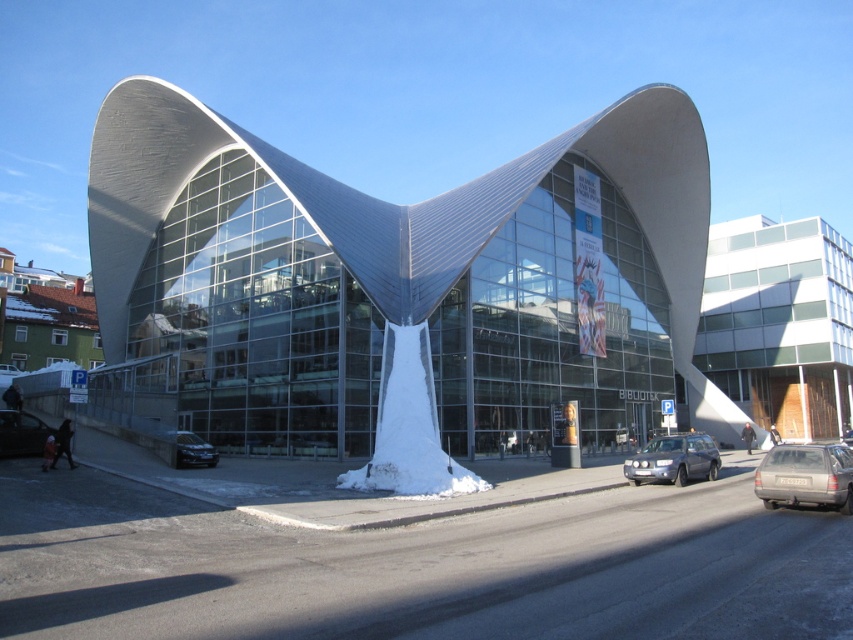
You are a delivery person arriving at the building and need to enter through the white wooden door at right. Is the satin black sedan at lower left blocking your path to the door?

The satin black sedan at lower left is behind the white wooden door at right, so it is not blocking the path to the door.